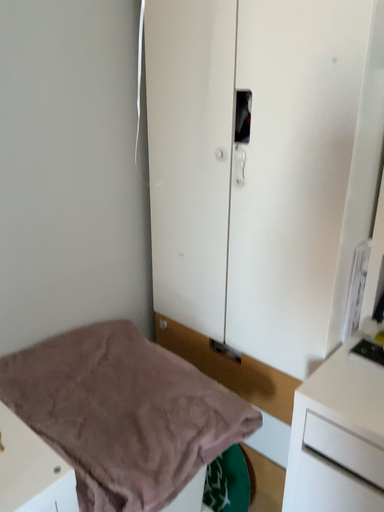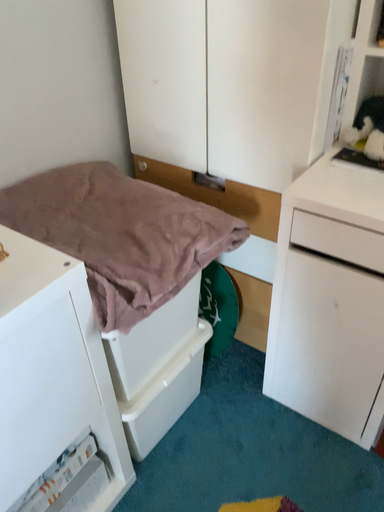
Question: Which way did the camera rotate in the video?

Choices:
 (A) rotated downward
 (B) rotated upward

Answer: (A)